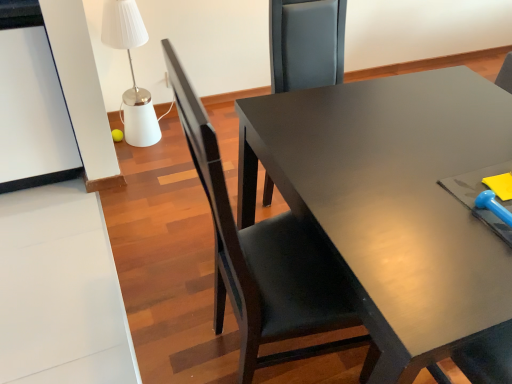
Question: Visually, is white glossy table lamp at upper left positioned to the left or to the right of matte black chair at center?

Choices:
 (A) right
 (B) left

Answer: (B)

Question: Relative to matte black chair at center, is white glossy table lamp at upper left in front or behind?

Choices:
 (A) front
 (B) behind

Answer: (B)

Question: Is white glossy table lamp at upper left spatially inside matte black chair at center, or outside of it?

Choices:
 (A) outside
 (B) inside

Answer: (A)

Question: Is point (326, 311) closer or farther from the camera than point (129, 49)?

Choices:
 (A) closer
 (B) farther

Answer: (A)

Question: From a real-world perspective, relative to white glossy table lamp at upper left, is matte black chair at center vertically above or below?

Choices:
 (A) above
 (B) below

Answer: (A)

Question: Considering their positions, is matte black chair at center located in front of or behind white glossy table lamp at upper left?

Choices:
 (A) behind
 (B) front

Answer: (B)

Question: From the image's perspective, is matte black chair at center located above or below white glossy table lamp at upper left?

Choices:
 (A) above
 (B) below

Answer: (B)